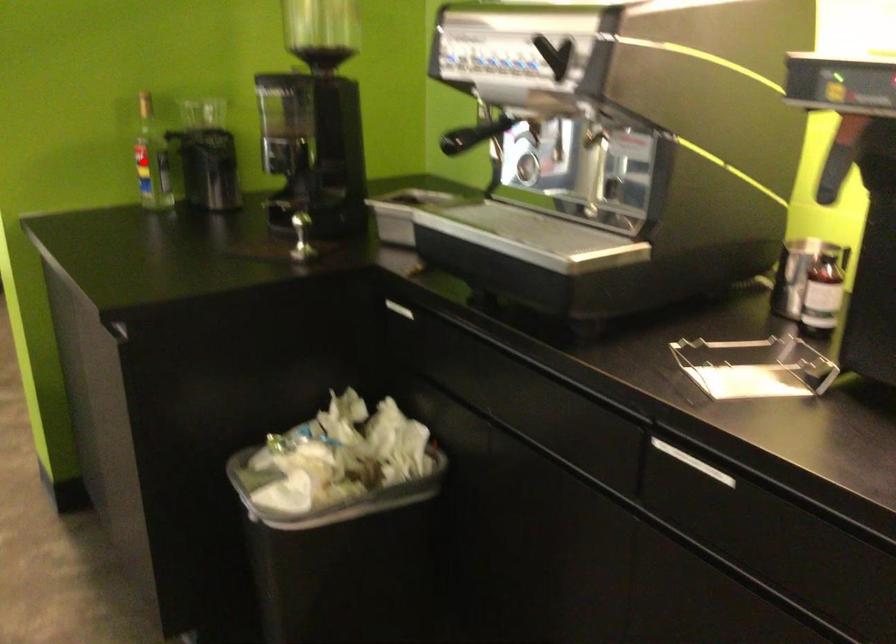
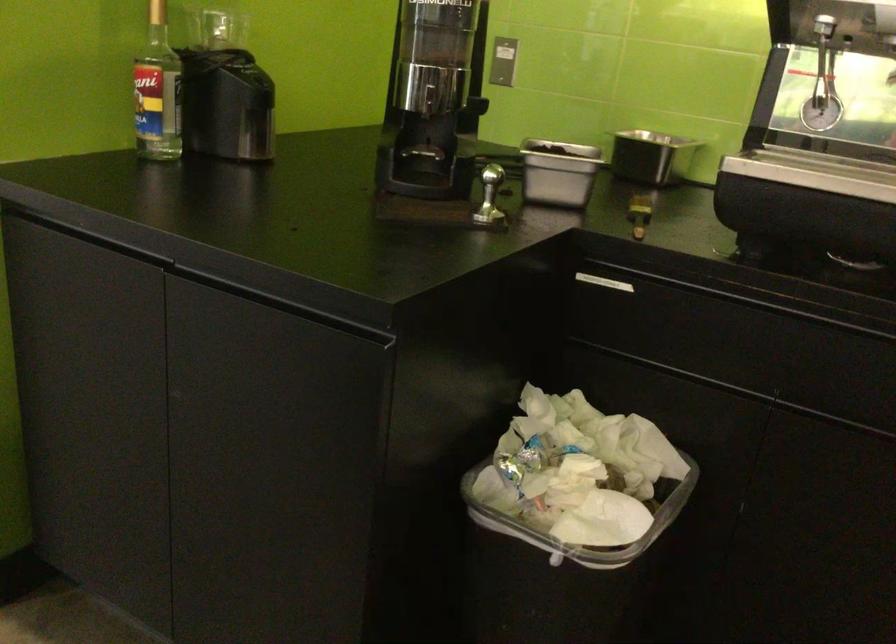
Find the pixel in the second image that matches the highlighted location in the first image.

(158, 91)